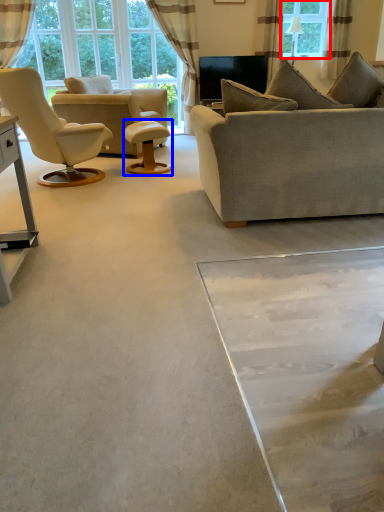
Question: Which object is closer to the camera taking this photo, window (highlighted by a red box) or round table (highlighted by a blue box)?

Choices:
 (A) window
 (B) round table

Answer: (B)